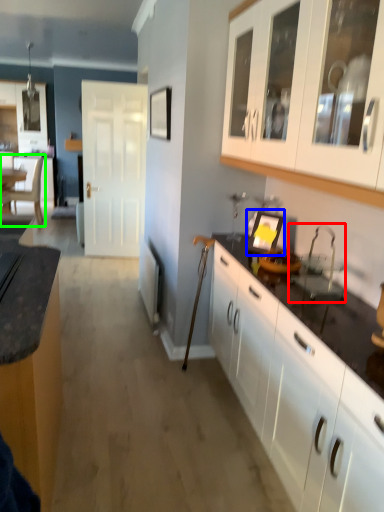
Question: Which object is positioned farthest from sink (highlighted by a red box)? Select from appliance (highlighted by a blue box) and chair (highlighted by a green box).

Choices:
 (A) appliance
 (B) chair

Answer: (B)